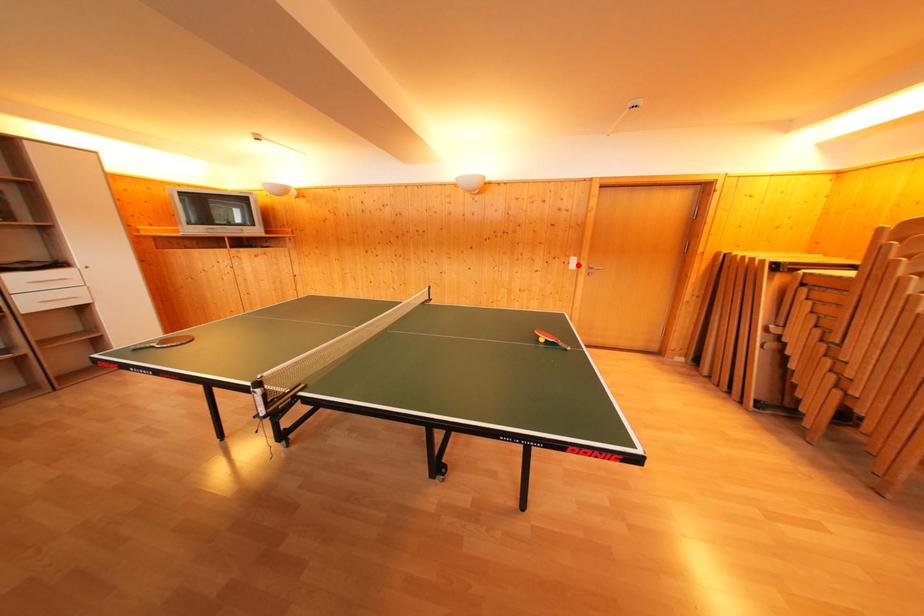
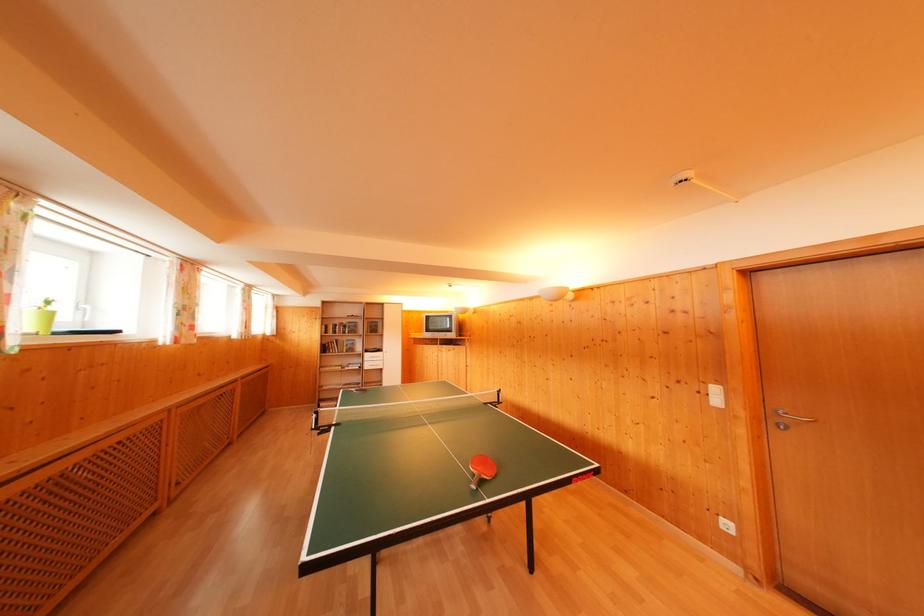
In the second image, find the point that corresponds to the highlighted location in the first image.

(721, 395)